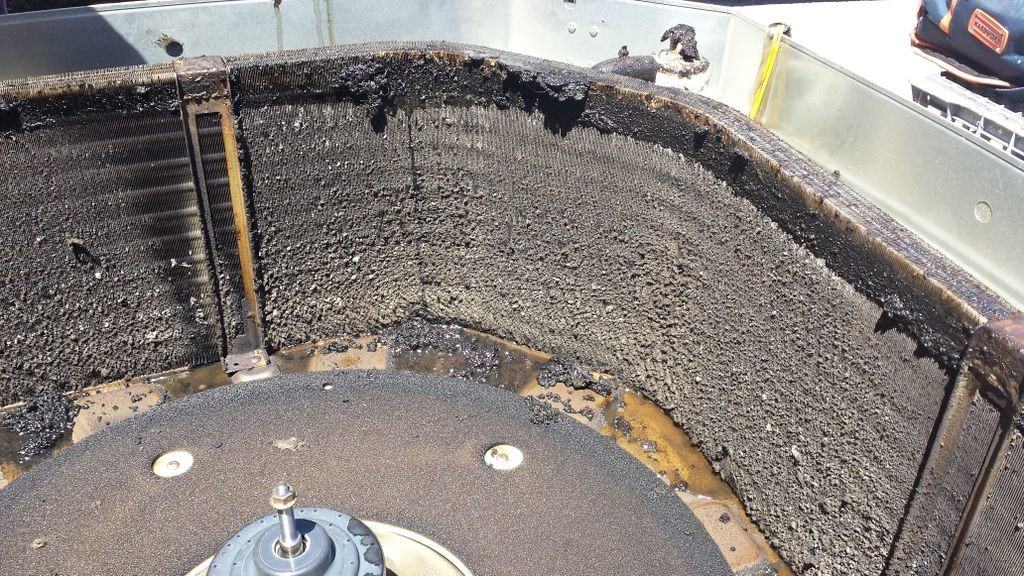
You are a GUI agent. You are given a task and a screenshot of the screen. Output one action in this format:
    pyautogui.click(x=<x>, y=<y>)
    Task: Click on the washer
    The image size is (1024, 576).
    Given the screenshot: What is the action you would take?
    pyautogui.click(x=503, y=454), pyautogui.click(x=169, y=460)